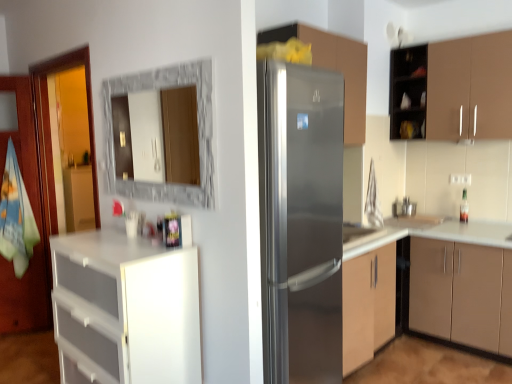
Question: Is satin silver refrigerator at center, which is the third cabinetry in right-to-left order, in front of or behind satin silver sink at center in the image?

Choices:
 (A) front
 (B) behind

Answer: (A)

Question: From a real-world perspective, relative to satin silver sink at center, is satin silver refrigerator at center, which is the 2th cabinetry in left-to-right order, vertically above or below?

Choices:
 (A) below
 (B) above

Answer: (B)

Question: Which object is the farthest from the stainless steel refrigerator at center?

Choices:
 (A) marble frame mirror at upper center
 (B) brown matte cabinet at upper right, acting as the first cabinetry starting from the right
 (C) matte brown cabinet at right, acting as the 3th cabinetry starting from the left
 (D) satin silver refrigerator at center, which is the third cabinetry in right-to-left order
 (E) white plastic drawers at left, arranged as the first cabinetry when viewed from the left

Answer: (B)

Question: Which object is the closest to the matte brown cabinet at right, acting as the 3th cabinetry starting from the left?

Choices:
 (A) satin silver refrigerator at center, which is the 2th cabinetry in left-to-right order
 (B) stainless steel refrigerator at center
 (C) marble frame mirror at upper center
 (D) brown matte cabinet at upper right, which is the fourth cabinetry from left to right
 (E) white plastic drawers at left, the 4th cabinetry positioned from the right

Answer: (B)